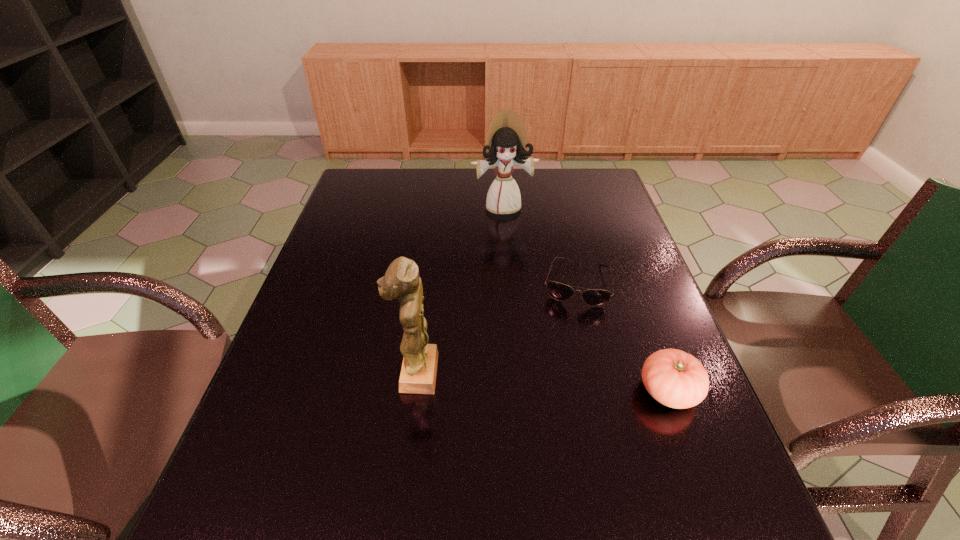
Locate an element on the screen. Image resolution: width=960 pixels, height=540 pixels. free space at the far left corner is located at coordinates (373, 183).

Find the location of a particular element. The image size is (960, 540). vacant space at the near left corner of the desktop is located at coordinates (266, 458).

The image size is (960, 540). Identify the location of vacant space at the far right corner of the desktop. (578, 176).

In order to click on free space between the sunglasses and the doll in this screenshot , I will do `click(540, 245)`.

Where is `free point between the doll and the figurine`? The width and height of the screenshot is (960, 540). free point between the doll and the figurine is located at coordinates 460,289.

This screenshot has height=540, width=960. I want to click on free space that is in between the sunglasses and the second shortest object, so click(x=622, y=337).

Identify the location of vacant area between the shortest object and the tomato. Image resolution: width=960 pixels, height=540 pixels. (622, 337).

At what (x,y) coordinates should I click in order to perform the action: click on unoccupied position between the shortest object and the doll. Please return your answer as a coordinate pair (x, y). Looking at the image, I should click on (540, 245).

Identify the location of free space that is in between the leftmost object and the doll. The width and height of the screenshot is (960, 540). (460, 289).

This screenshot has width=960, height=540. In order to click on free spot between the tomato and the leftmost object in this screenshot , I will do `click(542, 382)`.